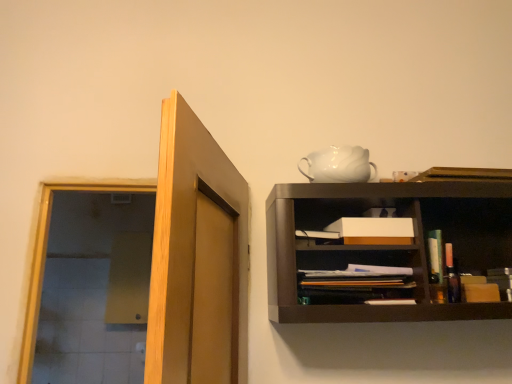
Image resolution: width=512 pixels, height=384 pixels. What do you see at coordinates (356, 284) in the screenshot? I see `matte black book at center` at bounding box center [356, 284].

The image size is (512, 384). What do you see at coordinates (196, 257) in the screenshot? I see `light brown wood door at upper left` at bounding box center [196, 257].

This screenshot has height=384, width=512. I want to click on matte black book at center, so click(x=356, y=284).

Between matte black book at center and white matte box at center, which one has larger width?

With larger width is matte black book at center.

Is matte black book at center at the left side of white matte box at center?

No.

From the image's perspective, is matte black book at center beneath white matte box at center?

Yes, from the image's perspective, matte black book at center is beneath white matte box at center.

From the image's perspective, between white glossy teapot at upper center and matte black book at center, which one is located above?

white glossy teapot at upper center.

Where is `book in front of the white glossy teapot at upper center`? This screenshot has width=512, height=384. book in front of the white glossy teapot at upper center is located at coordinates (356, 284).

Can you tell me how much white glossy teapot at upper center and matte black book at center differ in facing direction?

The angular difference between white glossy teapot at upper center and matte black book at center is 6.37 degrees.

Is white glossy teapot at upper center looking in the opposite direction of matte black book at center?

No, matte black book at center is not at the back of white glossy teapot at upper center.

Based on their positions, is matte black book at center located to the left or right of white glossy teapot at upper center?

Clearly, matte black book at center is on the right of white glossy teapot at upper center in the image.

Considering the sizes of matte black book at center and white glossy teapot at upper center in the image, is matte black book at center taller or shorter than white glossy teapot at upper center?

Clearly, matte black book at center is shorter compared to white glossy teapot at upper center.

Identify the location of book below the white glossy teapot at upper center (from a real-world perspective). Image resolution: width=512 pixels, height=384 pixels. (356, 284).

Is matte black book at center facing away from white glossy teapot at upper center?

matte black book at center does not have its back to white glossy teapot at upper center.

Which point is more forward, (415, 234) or (188, 173)?

The point (188, 173) is closer to the camera.

How different are the orientations of white matte box at center and light brown wood door at upper left in degrees?

They differ by 104 degrees in their facing directions.

Between white matte box at center and light brown wood door at upper left, which one has more height?

With more height is light brown wood door at upper left.

Is the depth of white matte box at center less than that of matte black book at center?

No, it is not.

Looking at this image, how far apart are white matte box at center and matte black book at center?

white matte box at center and matte black book at center are 5.98 inches apart from each other.

Is white matte box at center located outside matte black book at center?

That's correct, white matte box at center is outside of matte black book at center.

From the image's perspective, is white matte box at center above matte black book at center?

Yes, from the image's perspective, white matte box at center is on top of matte black book at center.

The height and width of the screenshot is (384, 512). I want to click on door above the matte black book at center (from a real-world perspective), so click(196, 257).

Considering the sizes of objects light brown wood door at upper left and matte black book at center in the image provided, who is wider, light brown wood door at upper left or matte black book at center?

With larger width is light brown wood door at upper left.

Which of these two, light brown wood door at upper left or matte black book at center, stands shorter?

With less height is matte black book at center.

From the picture: Is light brown wood door at upper left oriented away from matte black book at center?

Yes, light brown wood door at upper left is facing away from matte black book at center.

The image size is (512, 384). In order to click on door on the left of matte black book at center in this screenshot , I will do `click(196, 257)`.

Does matte black book at center have a greater height compared to light brown wood door at upper left?

In fact, matte black book at center may be shorter than light brown wood door at upper left.

Is light brown wood door at upper left located within matte black book at center?

No, matte black book at center does not contain light brown wood door at upper left.

Where is `cabinet that is above the matte black book at center (from the image's perspective)`? The height and width of the screenshot is (384, 512). cabinet that is above the matte black book at center (from the image's perspective) is located at coordinates (366, 230).

You are a GUI agent. You are given a task and a screenshot of the screen. Output one action in this format:
    pyautogui.click(x=<x>, y=<y>)
    Task: Click on the book in front of the white glossy teapot at upper center
    
    Given the screenshot: What is the action you would take?
    pyautogui.click(x=356, y=284)

When comparing their distances from light brown wood door at upper left, does white matte box at center or matte black book at center seem further?

Based on the image, white matte box at center appears to be further to light brown wood door at upper left.

When comparing their distances from matte black book at center, does white glossy teapot at upper center or white matte box at center seem closer?

white matte box at center is positioned closer to the anchor matte black book at center.

Looking at the image, which one is located further to white glossy teapot at upper center, matte black book at center or light brown wood door at upper left?

light brown wood door at upper left lies further to white glossy teapot at upper center than the other object.

From the picture: Which object lies nearer to the anchor point light brown wood door at upper left, matte black book at center or white matte box at center?

matte black book at center.

Estimate the real-world distances between objects in this image. Which object is further from matte black book at center, light brown wood door at upper left or white matte box at center?

Among the two, light brown wood door at upper left is located further to matte black book at center.

Looking at the image, which one is located further to light brown wood door at upper left, matte black book at center or white glossy teapot at upper center?

white glossy teapot at upper center is positioned further to the anchor light brown wood door at upper left.

Which object lies further to the anchor point white glossy teapot at upper center, light brown wood door at upper left or matte black book at center?

The object further to white glossy teapot at upper center is light brown wood door at upper left.

Which object lies nearer to the anchor point white glossy teapot at upper center, white matte box at center or light brown wood door at upper left?

white matte box at center is positioned closer to the anchor white glossy teapot at upper center.

The height and width of the screenshot is (384, 512). I want to click on cabinet between white glossy teapot at upper center and matte black book at center in the up-down direction, so click(x=366, y=230).

Identify the location of book between light brown wood door at upper left and white glossy teapot at upper center from front to back. The height and width of the screenshot is (384, 512). (356, 284).

At what (x,y) coordinates should I click in order to perform the action: click on book between light brown wood door at upper left and white matte box at center from front to back. Please return your answer as a coordinate pair (x, y). Looking at the image, I should click on (356, 284).

The width and height of the screenshot is (512, 384). Identify the location of cabinet between light brown wood door at upper left and white glossy teapot at upper center along the z-axis. (366, 230).